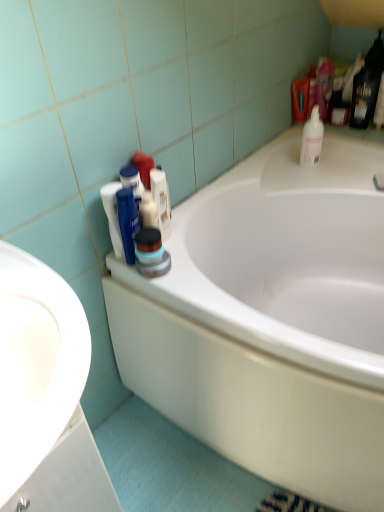
Question: Does white plastic bottle at upper right, which is the 2th cleaning product in bottom-to-top order, turn towards white glossy bathtub at center?

Choices:
 (A) no
 (B) yes

Answer: (A)

Question: From the image's perspective, is white plastic bottle at upper right, which is counted as the second cleaning product, starting from the front, below white glossy bathtub at center?

Choices:
 (A) no
 (B) yes

Answer: (A)

Question: Is white plastic bottle at upper right, arranged as the first cleaning product when viewed from the back, placed right next to white glossy bathtub at center?

Choices:
 (A) no
 (B) yes

Answer: (A)

Question: Is white plastic bottle at upper right, the 2th cleaning product viewed from the left, positioned with its back to white glossy bathtub at center?

Choices:
 (A) yes
 (B) no

Answer: (B)

Question: Is white plastic bottle at upper right, arranged as the first cleaning product when viewed from the back, to the right of white glossy bathtub at center from the viewer's perspective?

Choices:
 (A) no
 (B) yes

Answer: (B)

Question: Considering the relative positions of white plastic bottle at upper right, the 2th cleaning product viewed from the left, and white glossy bathtub at center in the image provided, is white plastic bottle at upper right, the 2th cleaning product viewed from the left, behind white glossy bathtub at center?

Choices:
 (A) yes
 (B) no

Answer: (A)

Question: Is matte black container at center, the first cleaning product in the bottom-to-top sequence, located within white glossy sink at left?

Choices:
 (A) yes
 (B) no

Answer: (B)

Question: Can you confirm if white glossy sink at left is smaller than matte black container at center, the first cleaning product in the bottom-to-top sequence?

Choices:
 (A) no
 (B) yes

Answer: (A)

Question: Is white glossy sink at left looking in the opposite direction of matte black container at center, the first cleaning product positioned from the left?

Choices:
 (A) yes
 (B) no

Answer: (B)

Question: Does white glossy sink at left have a greater height compared to matte black container at center, placed as the second cleaning product when sorted from back to front?

Choices:
 (A) no
 (B) yes

Answer: (B)

Question: From the image's perspective, is white glossy sink at left under matte black container at center, the 1th cleaning product in the front-to-back sequence?

Choices:
 (A) no
 (B) yes

Answer: (B)

Question: Is the position of white glossy sink at left more distant than that of matte black container at center, positioned as the 2th cleaning product in top-to-bottom order?

Choices:
 (A) no
 (B) yes

Answer: (A)

Question: Is white glossy bathtub at center far from white plastic bottle at upper right, which is the 2th cleaning product in bottom-to-top order?

Choices:
 (A) yes
 (B) no

Answer: (B)